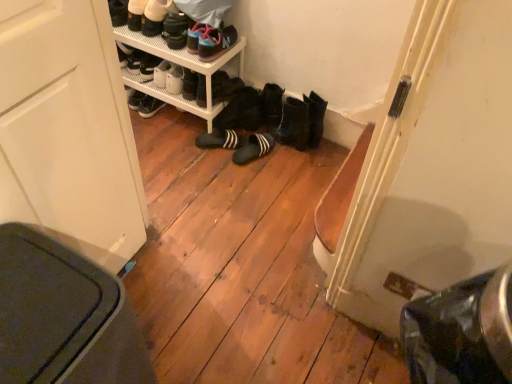
You are a GUI agent. You are given a task and a screenshot of the screen. Output one action in this format:
    pyautogui.click(x=<x>, y=<y>)
    Task: Click on the vacant region to the left of black suede slippers at center, marked as the 6th footwear in a top-to-bottom arrangement
    This screenshot has height=384, width=512.
    Given the screenshot: What is the action you would take?
    pyautogui.click(x=177, y=130)